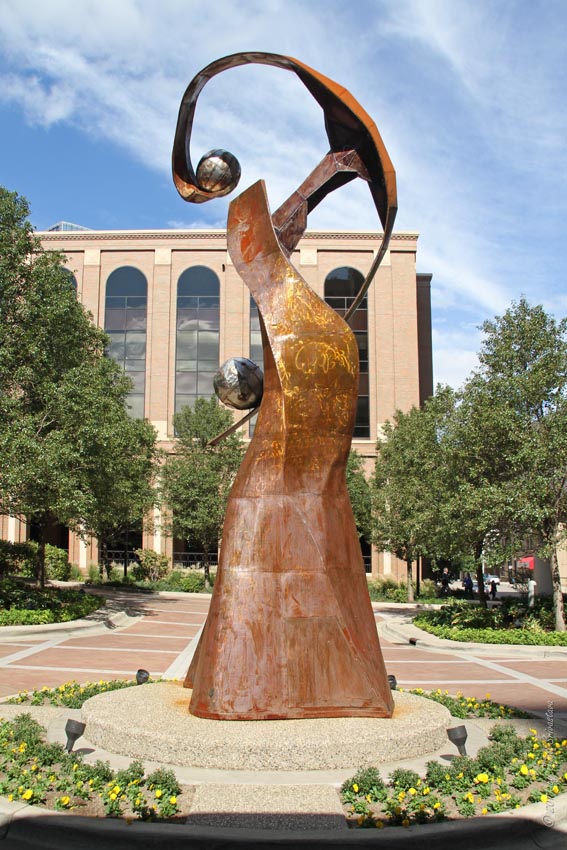
Identify the location of statue. This screenshot has width=567, height=850. (260, 656).